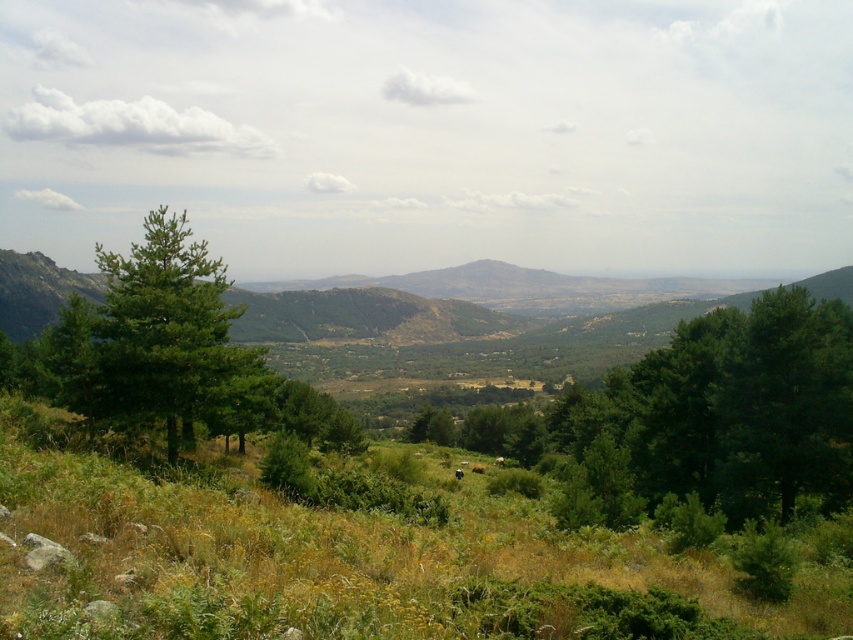
In the scene shown: You are a hiker standing on the green grassy field at center. You want to reach the green leafy tree at right. Which direction should you walk to get closer to the tree?

The green leafy tree at right is taller than the green grassy field at center, so you should walk towards the right to reach the green leafy tree at right.

You are standing at the point with coordinates point (459, 468) and want to move towards the point (33, 445). Given that you can only move in a straight line, will you be moving towards the foreground or the background of the image?

Since point (33, 445) is closer to the camera than point (459, 468), moving towards it means you are heading towards the foreground of the image.